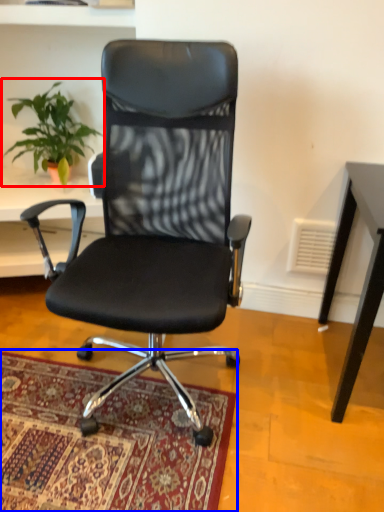
Question: Among these objects, which one is farthest to the camera, houseplant (highlighted by a red box) or mat (highlighted by a blue box)?

Choices:
 (A) houseplant
 (B) mat

Answer: (A)